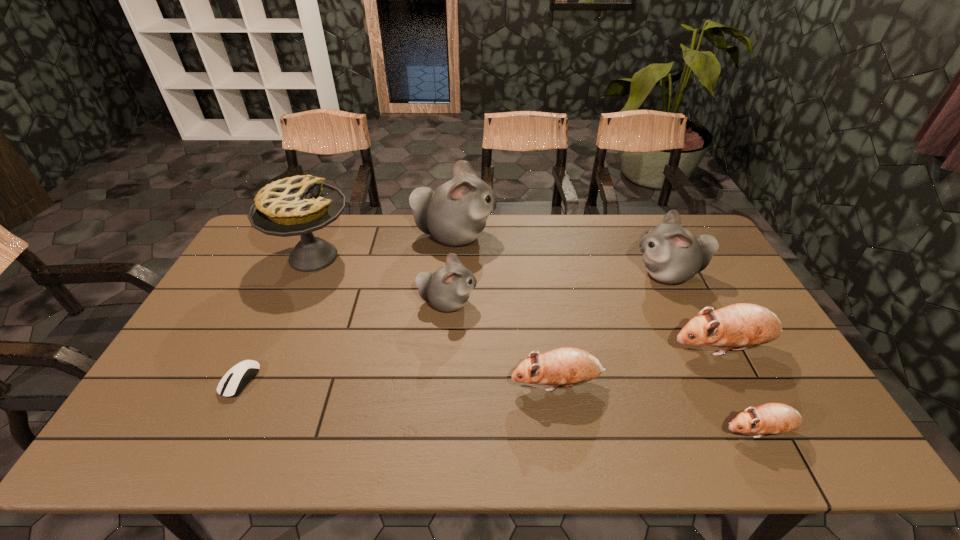
Locate which object is the seventh closest to the biggest white hamster. Please provide its 2D coordinates. Your answer should be formatted as a tuple, i.e. [(x, y)], where the tuple contains the x and y coordinates of a point satisfying the conditions above.

[(772, 418)]

I want to click on hamster that is the third nearest to the farthest hamster, so click(567, 366).

This screenshot has height=540, width=960. Identify the location of hamster that stands as the third closest to the second nearest brown hamster. (772, 418).

The width and height of the screenshot is (960, 540). I want to click on the closest white hamster to the smallest white hamster, so point(455,213).

The height and width of the screenshot is (540, 960). I want to click on the closest white hamster relative to the biggest white hamster, so click(447, 289).

Where is `brown hamster that is the second closest to the second smallest brown hamster`? This screenshot has height=540, width=960. brown hamster that is the second closest to the second smallest brown hamster is located at coordinates (772, 418).

Find the location of a particular element. The image size is (960, 540). the second closest brown hamster to the smallest brown hamster is located at coordinates click(567, 366).